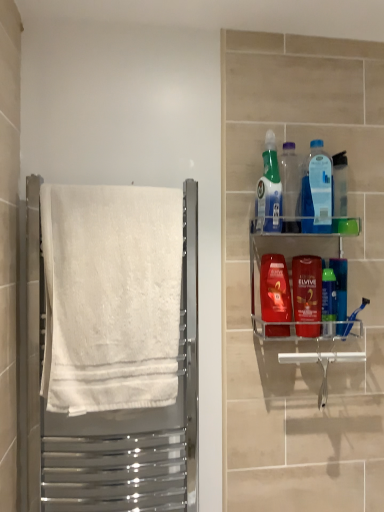
What is the approximate width of green plastic mouthwash at right, the third mouthwash positioned from the left?

1.83 inches.

What is the approximate width of transparent plastic bottle at upper center, the 1th bottle in the left-to-right sequence?

transparent plastic bottle at upper center, the 1th bottle in the left-to-right sequence, is 2.78 inches wide.

Identify the location of blue plastic bottle at upper right, which appears as the 2th cleaning product when viewed from the left. (317, 191).

Which mouthwash is the 1st one when counting from the front of the green plastic mouthwash at right, which is counted as the first mouthwash, starting from the right? Please provide its 2D coordinates.

[(328, 302)]

Does green plastic mouthwash at right, which is counted as the first mouthwash, starting from the right, appear on the left side of green plastic mouthwash at right, the third mouthwash positioned from the left?

No, green plastic mouthwash at right, which is counted as the first mouthwash, starting from the right, is not to the left of green plastic mouthwash at right, the third mouthwash positioned from the left.

Can you confirm if green plastic mouthwash at right, which is counted as the first mouthwash, starting from the right, is wider than green plastic mouthwash at right, which is the 2th mouthwash in right-to-left order?

Correct, the width of green plastic mouthwash at right, which is counted as the first mouthwash, starting from the right, exceeds that of green plastic mouthwash at right, which is the 2th mouthwash in right-to-left order.

Would you consider green plastic mouthwash at right, which is counted as the first mouthwash, starting from the right, to be distant from green plastic mouthwash at right, the third mouthwash positioned from the left?

No, green plastic mouthwash at right, which is counted as the first mouthwash, starting from the right, is in close proximity to green plastic mouthwash at right, the third mouthwash positioned from the left.

Is translucent plastic mouthwash at center right, placed as the 2th mouthwash when sorted from left to right, wider than transparent plastic bottle at upper center, the 2th bottle from the right?

Yes.

Which object is more forward, translucent plastic mouthwash at center right, placed as the 2th mouthwash when sorted from left to right, or transparent plastic bottle at upper center, the 1th bottle in the left-to-right sequence?

translucent plastic mouthwash at center right, placed as the 2th mouthwash when sorted from left to right, is closer to the camera.

From a real-world perspective, who is located lower, translucent plastic mouthwash at center right, placed as the 2th mouthwash when sorted from left to right, or transparent plastic bottle at upper center, the 2th bottle from the right?

From a 3D spatial view, translucent plastic mouthwash at center right, placed as the 2th mouthwash when sorted from left to right, is below.

How different are the orientations of translucent plastic mouthwash at center right, placed as the 2th mouthwash when sorted from left to right, and transparent plastic bottle at upper center, the 2th bottle from the right, in degrees?

The angle between the facing direction of translucent plastic mouthwash at center right, placed as the 2th mouthwash when sorted from left to right, and the facing direction of transparent plastic bottle at upper center, the 2th bottle from the right, is 0.00659 degrees.

From a real-world perspective, is transparent plastic bottle at upper center, the 2th bottle from the right, located higher than translucent plastic mouthwash at center right, which is the third mouthwash from right to left?

Correct, in the physical world, transparent plastic bottle at upper center, the 2th bottle from the right, is higher than translucent plastic mouthwash at center right, which is the third mouthwash from right to left.

Does point (298, 196) appear closer or farther from the camera than point (304, 326)?

Clearly, point (298, 196) is more distant from the camera than point (304, 326).

Looking at this image, does transparent plastic bottle at upper center, the 2th bottle from the right, appear on the right side of translucent plastic mouthwash at center right, which is the third mouthwash from right to left?

Incorrect, transparent plastic bottle at upper center, the 2th bottle from the right, is not on the right side of translucent plastic mouthwash at center right, which is the third mouthwash from right to left.

Is transparent plastic bottle at upper center, the 1th bottle in the left-to-right sequence, to the right of green plastic mouthwash at right, which is the 2th mouthwash in right-to-left order, from the viewer's perspective?

No, transparent plastic bottle at upper center, the 1th bottle in the left-to-right sequence, is not to the right of green plastic mouthwash at right, which is the 2th mouthwash in right-to-left order.

Which of these two, transparent plastic bottle at upper center, the 1th bottle in the left-to-right sequence, or green plastic mouthwash at right, which is the 2th mouthwash in right-to-left order, stands shorter?

Standing shorter between the two is green plastic mouthwash at right, which is the 2th mouthwash in right-to-left order.

Are transparent plastic bottle at upper center, the 2th bottle from the right, and green plastic mouthwash at right, which is the 2th mouthwash in right-to-left order, beside each other?

transparent plastic bottle at upper center, the 2th bottle from the right, and green plastic mouthwash at right, which is the 2th mouthwash in right-to-left order, are not in contact.

Considering the sizes of objects transparent plastic bottle at upper center, the 2th bottle from the right, and green plastic mouthwash at right, the third mouthwash positioned from the left, in the image provided, who is thinner, transparent plastic bottle at upper center, the 2th bottle from the right, or green plastic mouthwash at right, the third mouthwash positioned from the left,?

green plastic mouthwash at right, the third mouthwash positioned from the left.

Can you confirm if translucent plastic spray bottle at upper right, which is counted as the 2th cleaning product, starting from the right, is thinner than translucent plastic mouthwash at center right, placed as the 2th mouthwash when sorted from left to right?

No, translucent plastic spray bottle at upper right, which is counted as the 2th cleaning product, starting from the right, is not thinner than translucent plastic mouthwash at center right, placed as the 2th mouthwash when sorted from left to right.

From the image's perspective, is translucent plastic spray bottle at upper right, which appears as the 1th cleaning product when viewed from the left, on top of translucent plastic mouthwash at center right, placed as the 2th mouthwash when sorted from left to right?

Yes.

Where is `the 2nd cleaning product above when counting from the translucent plastic mouthwash at center right, which is the third mouthwash from right to left (from the image's perspective)`? The height and width of the screenshot is (512, 384). the 2nd cleaning product above when counting from the translucent plastic mouthwash at center right, which is the third mouthwash from right to left (from the image's perspective) is located at coordinates (269, 190).

Between translucent plastic mouthwash at center right, placed as the 2th mouthwash when sorted from left to right, and white cotton towel at left, which one is positioned in front?

white cotton towel at left is closer to the camera.

Is translucent plastic mouthwash at center right, which is the third mouthwash from right to left, oriented away from white cotton towel at left?

No, translucent plastic mouthwash at center right, which is the third mouthwash from right to left,'s orientation is not away from white cotton towel at left.

Would you say translucent plastic mouthwash at center right, placed as the 2th mouthwash when sorted from left to right, is to the left or to the right of white cotton towel at left in the picture?

Clearly, translucent plastic mouthwash at center right, placed as the 2th mouthwash when sorted from left to right, is on the right of white cotton towel at left in the image.

Is point (256, 271) positioned after point (272, 149)?

Yes.

Is clear acrylic shelf at upper right placed right next to translucent plastic spray bottle at upper right, which is counted as the 2th cleaning product, starting from the right?

No, clear acrylic shelf at upper right is not in contact with translucent plastic spray bottle at upper right, which is counted as the 2th cleaning product, starting from the right.

Considering the positions of objects clear acrylic shelf at upper right and translucent plastic spray bottle at upper right, which is counted as the 2th cleaning product, starting from the right, in the image provided, who is behind, clear acrylic shelf at upper right or translucent plastic spray bottle at upper right, which is counted as the 2th cleaning product, starting from the right,?

Positioned behind is translucent plastic spray bottle at upper right, which is counted as the 2th cleaning product, starting from the right.

Which mouthwash is the 1st one when counting from the left side of the green plastic mouthwash at right, which is the 4th mouthwash in left-to-right order? Please provide its 2D coordinates.

[(328, 302)]

From a real-world perspective, count 2nd bottles upward from the translucent plastic mouthwash at center right, which is the third mouthwash from right to left, and point to it. Please provide its 2D coordinates.

[(290, 188)]

Looking at the image, which one is located further to blue plastic bottle at upper right, positioned as the first cleaning product in right-to-left order, translucent plastic spray bottle at upper right, which is counted as the 2th cleaning product, starting from the right, or green plastic mouthwash at right, which is the 4th mouthwash in left-to-right order?

green plastic mouthwash at right, which is the 4th mouthwash in left-to-right order.

From the picture: When comparing their distances from translucent plastic spray bottle at upper right, which is counted as the 2th cleaning product, starting from the right, does transparent plastic bottle at upper center, the 1th bottle in the left-to-right sequence, or transparent plastic bottle at upper right, the first bottle when ordered from right to left, seem closer?

transparent plastic bottle at upper center, the 1th bottle in the left-to-right sequence, lies closer to translucent plastic spray bottle at upper right, which is counted as the 2th cleaning product, starting from the right, than the other object.

When comparing their distances from green plastic mouthwash at right, which is the 4th mouthwash in left-to-right order, does clear acrylic shelf at upper right or translucent blue mouthwash at center right, which is the 1th mouthwash from left to right, seem further?

translucent blue mouthwash at center right, which is the 1th mouthwash from left to right.

Estimate the real-world distances between objects in this image. Which object is further from translucent blue mouthwash at center right, which is the 1th mouthwash from left to right, green plastic mouthwash at right, which is counted as the first mouthwash, starting from the right, or translucent plastic mouthwash at center right, which is the third mouthwash from right to left?

green plastic mouthwash at right, which is counted as the first mouthwash, starting from the right, is positioned further to the anchor translucent blue mouthwash at center right, which is the 1th mouthwash from left to right.

From the image, which object appears to be nearer to clear acrylic shelf at upper right, green plastic mouthwash at right, which is counted as the first mouthwash, starting from the right, or translucent blue mouthwash at center right, marked as the fourth mouthwash in a right-to-left arrangement?

translucent blue mouthwash at center right, marked as the fourth mouthwash in a right-to-left arrangement, is positioned closer to the anchor clear acrylic shelf at upper right.

When comparing their distances from translucent plastic mouthwash at center right, placed as the 2th mouthwash when sorted from left to right, does white cotton towel at left or blue plastic bottle at upper right, positioned as the first cleaning product in right-to-left order, seem closer?

The object closer to translucent plastic mouthwash at center right, placed as the 2th mouthwash when sorted from left to right, is blue plastic bottle at upper right, positioned as the first cleaning product in right-to-left order.

From the picture: Which object lies nearer to the anchor point white cotton towel at left, blue plastic bottle at upper right, positioned as the first cleaning product in right-to-left order, or translucent plastic mouthwash at center right, which is the third mouthwash from right to left?

The object closer to white cotton towel at left is translucent plastic mouthwash at center right, which is the third mouthwash from right to left.

From the image, which object appears to be nearer to green plastic mouthwash at right, the third mouthwash positioned from the left, transparent plastic bottle at upper right, the first bottle when ordered from right to left, or translucent plastic mouthwash at center right, placed as the 2th mouthwash when sorted from left to right?

translucent plastic mouthwash at center right, placed as the 2th mouthwash when sorted from left to right.

I want to click on mouthwash between white cotton towel at left and translucent plastic mouthwash at center right, placed as the 2th mouthwash when sorted from left to right, from left to right, so click(x=275, y=289).

Find the location of a particular element. Image resolution: width=384 pixels, height=512 pixels. cleaning product between transparent plastic bottle at upper center, the 2th bottle from the right, and clear acrylic shelf at upper right from top to bottom is located at coordinates (317, 191).

Find the location of a particular element. mouthwash between transparent plastic bottle at upper center, the 2th bottle from the right, and translucent plastic mouthwash at center right, placed as the 2th mouthwash when sorted from left to right, from top to bottom is located at coordinates (275, 289).

Find the location of `bottle located between white cotton towel at left and translucent plastic mouthwash at center right, which is the third mouthwash from right to left, in the left-right direction`. bottle located between white cotton towel at left and translucent plastic mouthwash at center right, which is the third mouthwash from right to left, in the left-right direction is located at coordinates (290, 188).